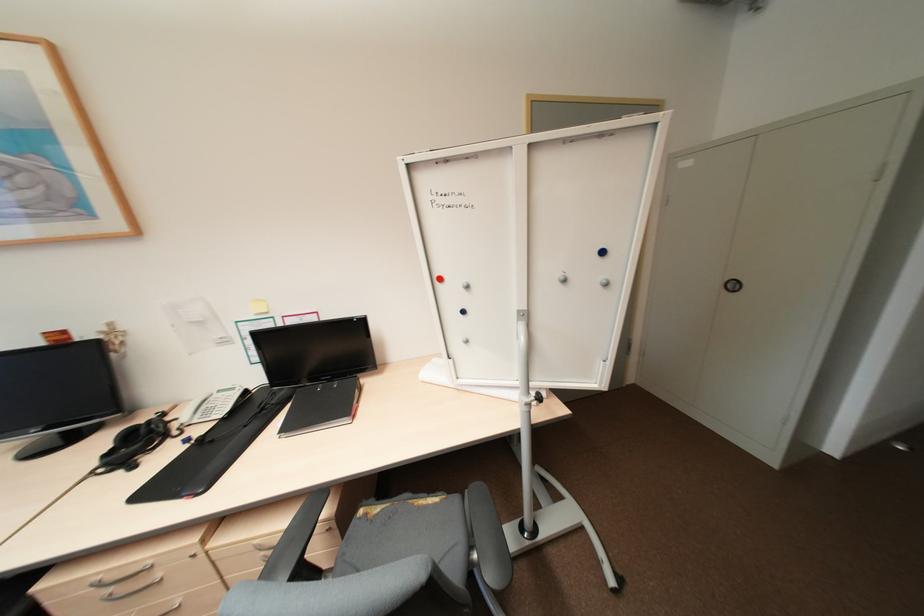
Identify the location of telephone handset. (191, 411).